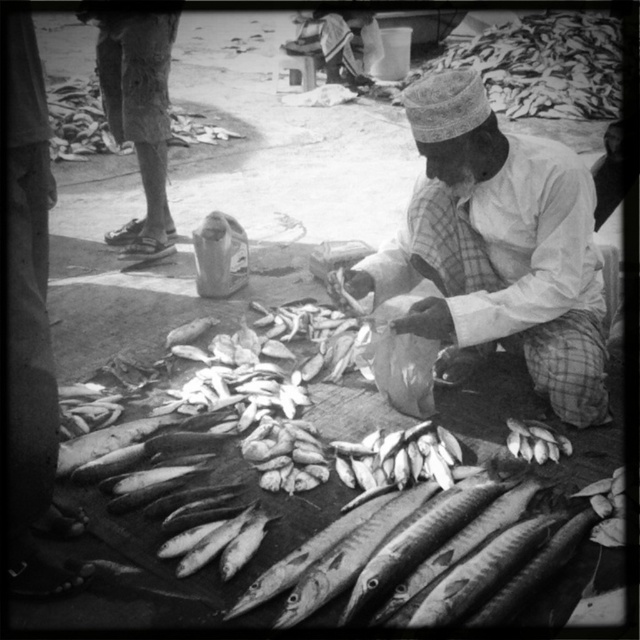
Who is shorter, white cotton shirt at center or smooth silver fish at lower right?

Standing shorter between the two is smooth silver fish at lower right.

Is white cotton shirt at center further to camera compared to smooth silver fish at lower right?

No, it is not.

In the scene shown: Who is more distant from viewer, (506, 310) or (548, 433)?

Positioned behind is point (548, 433).

Find the location of a particular element. white cotton shirt at center is located at coordinates (497, 248).

Does smooth silver fish at center lie in front of white cotton shirt at center?

Yes, smooth silver fish at center is in front of white cotton shirt at center.

Is smooth silver fish at center to the right of white cotton shirt at center from the viewer's perspective?

In fact, smooth silver fish at center is to the left of white cotton shirt at center.

Which is behind, point (124, 474) or point (406, 112)?

The point (406, 112) is behind.

Identify the location of smooth silver fish at center. (260, 545).

Can you confirm if smooth silver fish at center is positioned to the right of smooth silver fish at lower right?

No, smooth silver fish at center is not to the right of smooth silver fish at lower right.

Does point (326, 524) come farther from viewer compared to point (540, 458)?

No, (326, 524) is in front of (540, 458).

The image size is (640, 640). In order to click on smooth silver fish at center in this screenshot , I will do `click(260, 545)`.